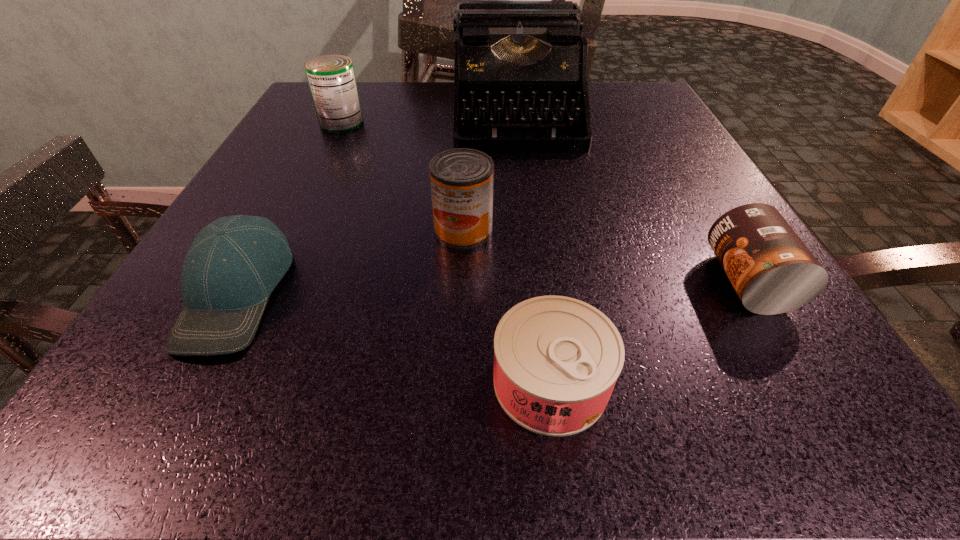
I want to click on free location located on the front label of the second shortest can, so click(645, 282).

At what (x,y) coordinates should I click in order to perform the action: click on vacant space located 0.180m on the front label of the second shortest can. Please return your answer as a coordinate pair (x, y). The height and width of the screenshot is (540, 960). Looking at the image, I should click on coord(578,282).

Locate an element on the screen. free point located on the front label of the second shortest can is located at coordinates (578, 282).

Image resolution: width=960 pixels, height=540 pixels. What are the coordinates of `vacant area situated 0.380m on the right of the baseball cap` in the screenshot? It's located at (575, 293).

I want to click on free space located on the right of the shortest can, so click(x=839, y=381).

At what (x,y) coordinates should I click in order to perform the action: click on typewriter positioned at the far edge. Please return your answer as a coordinate pair (x, y). Looking at the image, I should click on (523, 61).

Identify the location of can at the far edge. This screenshot has height=540, width=960. (331, 78).

At what (x,y) coordinates should I click in order to perform the action: click on baseball cap situated at the near edge. Please return your answer as a coordinate pair (x, y). Looking at the image, I should click on pos(234,263).

In order to click on can present at the near edge in this screenshot , I will do `click(556, 359)`.

Locate an element on the screen. This screenshot has width=960, height=540. can situated at the left edge is located at coordinates (331, 78).